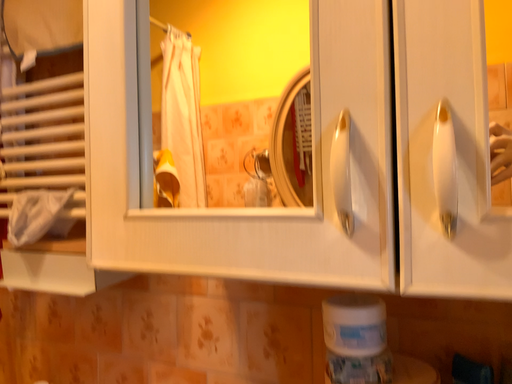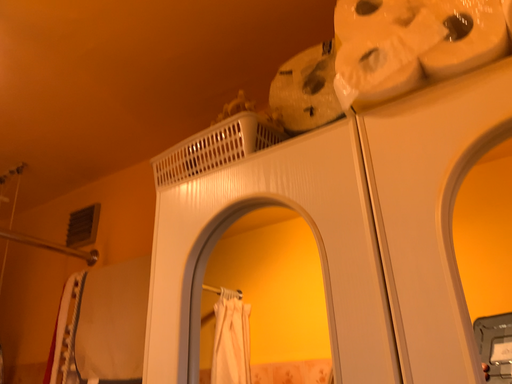
Question: How did the camera likely rotate when shooting the video?

Choices:
 (A) rotated downward
 (B) rotated upward

Answer: (B)